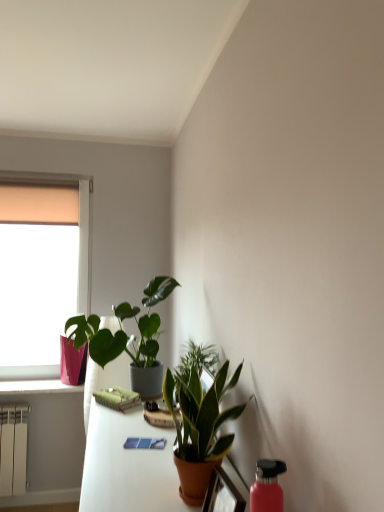
Locate an element on the screen. Image resolution: width=384 pixels, height=512 pixels. free spot below green glossy houseplant at center, the 1th houseplant positioned from the right (from a real-world perspective) is located at coordinates (200, 500).